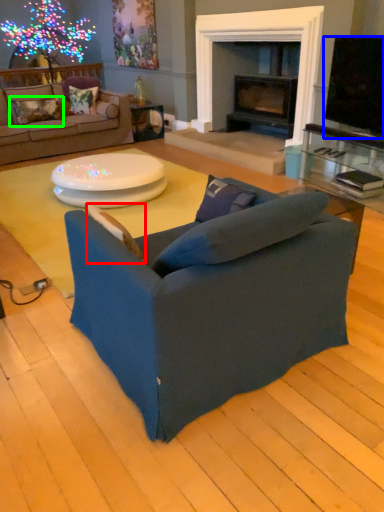
Question: Which object is positioned farthest from pillow (highlighted by a red box)? Select from television (highlighted by a blue box) and pillow (highlighted by a green box).

Choices:
 (A) television
 (B) pillow

Answer: (B)